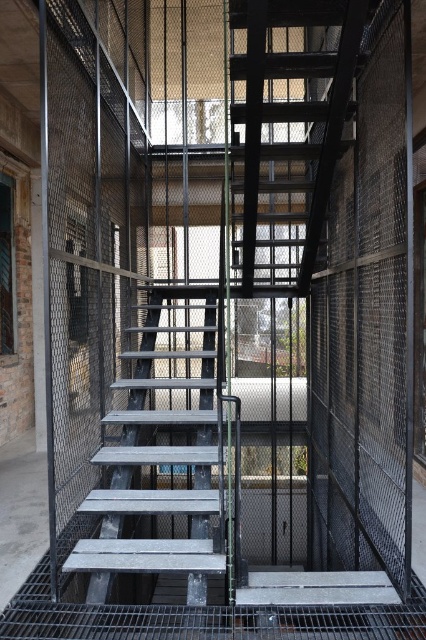
You are standing at the base of the staircase and want to climb up to the upper level. Which part of the staircase should you step onto first, the matte black staircase at center or the metallic gray stairs at center?

You should step onto the matte black staircase at center first because it is closer to the viewer than the metallic gray stairs at center, which are further away.

You are standing at the bottom of the staircase and want to reach the upper level. Which object should you climb first, the matte black staircase at center or the metallic gray stairs at center?

You should climb the metallic gray stairs at center first because the matte black staircase at center is positioned over it, meaning the metallic gray stairs at center are lower and closer to your starting position.